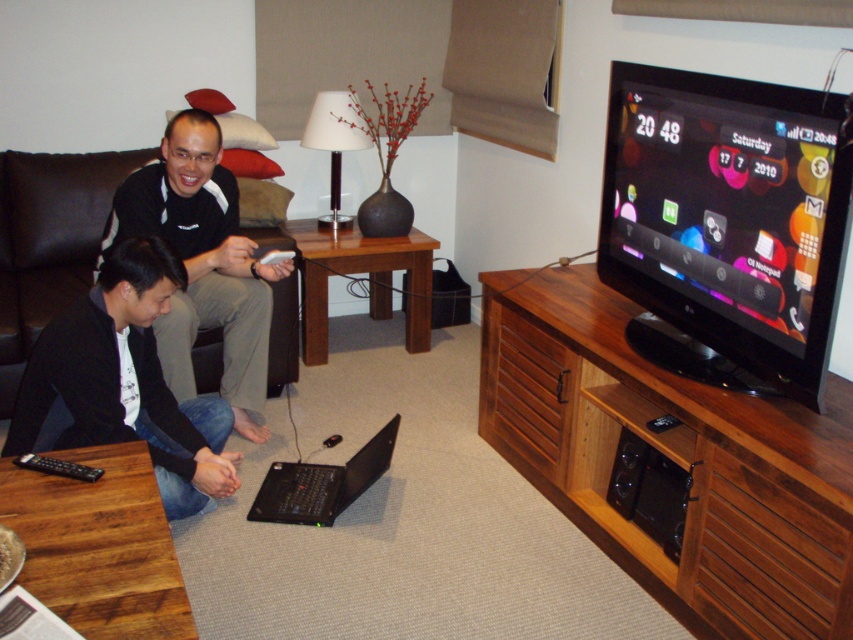
Can you confirm if brown leather couch at center is positioned to the right of white plastic remote at lower center?

Incorrect, brown leather couch at center is not on the right side of white plastic remote at lower center.

Describe the element at coordinates (49, 241) in the screenshot. I see `brown leather couch at center` at that location.

Locate an element on the screen. This screenshot has width=853, height=640. brown leather couch at center is located at coordinates (49, 241).

Is black glossy tv at upper right shorter than brown leather couch at center?

Yes, black glossy tv at upper right is shorter than brown leather couch at center.

Between point (614, 234) and point (4, 280), which one is positioned behind?

The point (4, 280) is more distant.

This screenshot has height=640, width=853. Find the location of `black glossy tv at upper right`. black glossy tv at upper right is located at coordinates (727, 225).

Which of these two, black glossy tv at upper right or black matte laptop at lower center, stands taller?

black glossy tv at upper right is taller.

What do you see at coordinates (727, 225) in the screenshot? The height and width of the screenshot is (640, 853). I see `black glossy tv at upper right` at bounding box center [727, 225].

Between point (740, 202) and point (289, 472), which one is positioned in front?

Point (740, 202)

This screenshot has height=640, width=853. I want to click on black glossy tv at upper right, so click(x=727, y=225).